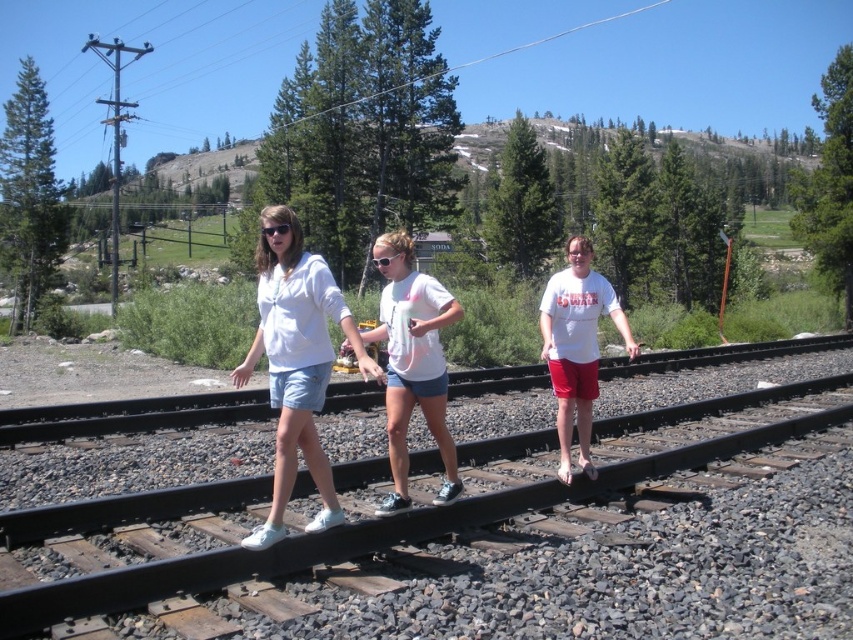
Is black metal train track at center smaller than black plastic goggles at center?

Yes, black metal train track at center is smaller than black plastic goggles at center.

Does black metal train track at center have a lesser width compared to black plastic goggles at center?

No, black metal train track at center is not thinner than black plastic goggles at center.

Does point (316, 628) lie behind point (392, 253)?

No.

Find the location of a particular element. black metal train track at center is located at coordinates (485, 540).

Is point (286, 308) behind point (392, 348)?

No, it is not.

Does white cotton shorts at center come in front of white cotton t-shirt at center?

Yes, white cotton shorts at center is in front of white cotton t-shirt at center.

Is point (287, 422) more distant than point (422, 371)?

That is False.

Where is `white cotton shorts at center`? The image size is (853, 640). white cotton shorts at center is located at coordinates (296, 364).

Who is more forward, (634, 538) or (415, 353)?

Point (415, 353)

Find the location of `black metal train track at center`. black metal train track at center is located at coordinates (485, 540).

Locate an element on the screen. The height and width of the screenshot is (640, 853). black metal train track at center is located at coordinates (x=485, y=540).